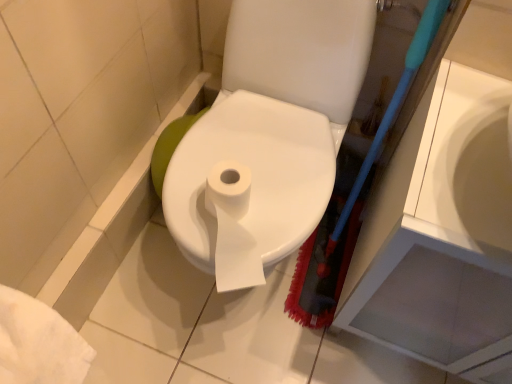
Looking at this image, what is the approximate height of white paper at center?

white paper at center is 6.21 inches tall.

This screenshot has height=384, width=512. Describe the element at coordinates (248, 186) in the screenshot. I see `white paper at center` at that location.

Image resolution: width=512 pixels, height=384 pixels. What are the coordinates of `white paper at center` in the screenshot? It's located at (248, 186).

Locate an element on the screen. The width and height of the screenshot is (512, 384). white paper at center is located at coordinates (248, 186).